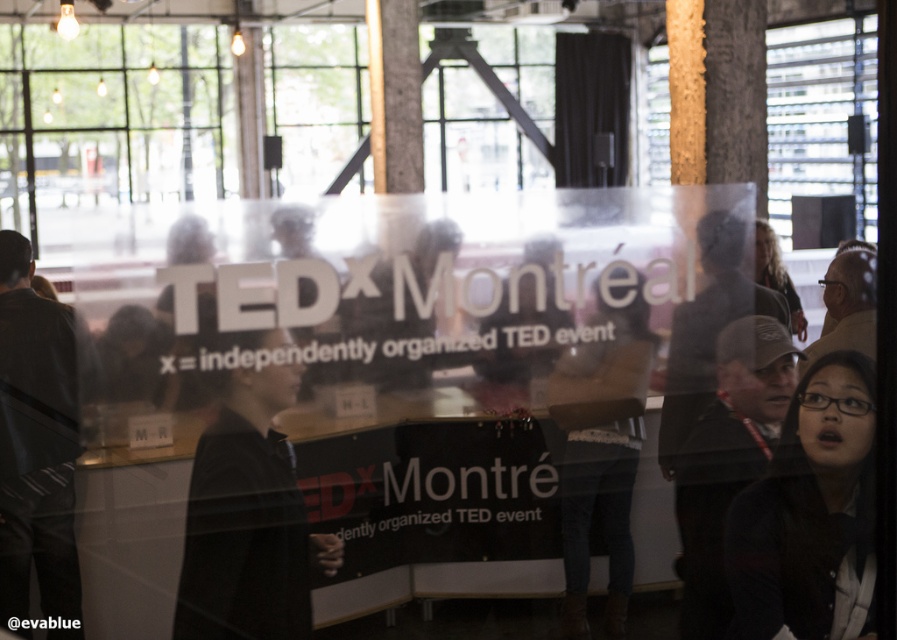
Image resolution: width=897 pixels, height=640 pixels. What do you see at coordinates (810, 515) in the screenshot? I see `black matte jacket at lower right` at bounding box center [810, 515].

Can you confirm if black matte jacket at lower right is positioned to the right of dark gray cap at center?

Correct, you'll find black matte jacket at lower right to the right of dark gray cap at center.

You are a GUI agent. You are given a task and a screenshot of the screen. Output one action in this format:
    pyautogui.click(x=<x>, y=<y>)
    Task: Click on the black matte jacket at lower right
    The width and height of the screenshot is (897, 640).
    Given the screenshot: What is the action you would take?
    pyautogui.click(x=810, y=515)

Identify the location of black matte jacket at lower right. The image size is (897, 640). (810, 515).

Between black matte jacket at lower right and denim pants at center, which one appears on the right side from the viewer's perspective?

From the viewer's perspective, black matte jacket at lower right appears more on the right side.

Is point (813, 445) in front of point (604, 401)?

No, (813, 445) is further to viewer.

Where is `black matte jacket at lower right`? black matte jacket at lower right is located at coordinates (810, 515).

Who is shorter, black matte jacket at center or dark gray cap at center?

With less height is black matte jacket at center.

Is black matte jacket at center smaller than dark gray cap at center?

Yes.

Does point (254, 429) come in front of point (787, 355)?

Yes, it is in front of point (787, 355).

At what (x,y) coordinates should I click in order to perform the action: click on black matte jacket at center. Please return your answer as a coordinate pair (x, y). This screenshot has height=640, width=897. Looking at the image, I should click on (249, 520).